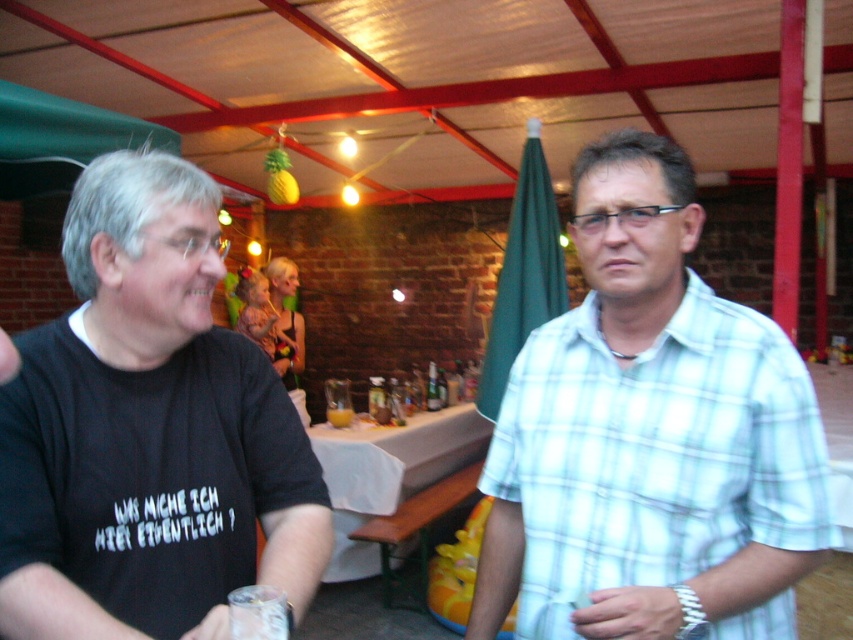
Question: Which object is positioned closest to the light blue plaid shirt at center?

Choices:
 (A) white fabric-covered table at center
 (B) black t-shirt at left
 (C) blonde hair baby at center

Answer: (B)

Question: Can you confirm if black t-shirt at left is positioned to the left of white fabric-covered table at center?

Choices:
 (A) no
 (B) yes

Answer: (B)

Question: Does black t-shirt at left appear on the left side of blonde hair baby at center?

Choices:
 (A) no
 (B) yes

Answer: (A)

Question: Does light blue plaid shirt at center appear over black t-shirt at left?

Choices:
 (A) yes
 (B) no

Answer: (B)

Question: Estimate the real-world distances between objects in this image. Which object is farther from the blonde hair baby at center?

Choices:
 (A) black t-shirt at left
 (B) light blue plaid shirt at center
 (C) white fabric-covered table at center

Answer: (A)

Question: Estimate the real-world distances between objects in this image. Which object is farther from the light blue plaid shirt at center?

Choices:
 (A) blonde hair baby at center
 (B) white fabric-covered table at center
 (C) black t-shirt at left

Answer: (A)